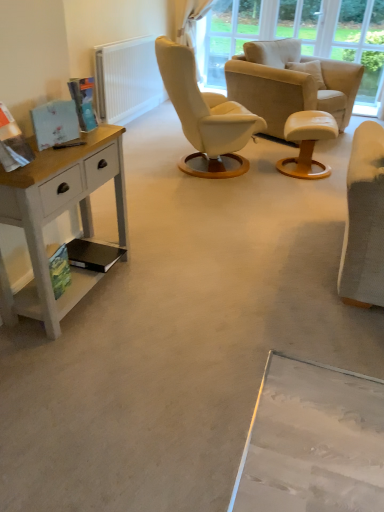
At what (x,y) coordinates should I click in order to perform the action: click on vacant space to the right of white painted wood desk at left. Please return your answer as a coordinate pair (x, y). This screenshot has height=512, width=384. Looking at the image, I should click on pos(161,293).